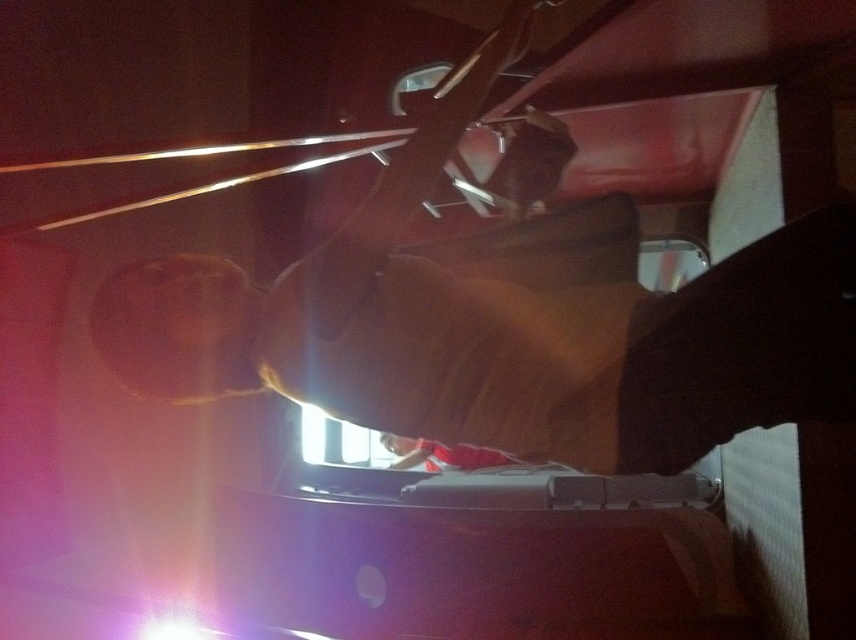
Question: Is brown leather jacket at center smaller than red fabric at center?

Choices:
 (A) yes
 (B) no

Answer: (B)

Question: Does brown leather jacket at center have a lesser width compared to red fabric at center?

Choices:
 (A) yes
 (B) no

Answer: (B)

Question: Can you confirm if brown leather jacket at center is positioned to the left of red fabric at center?

Choices:
 (A) no
 (B) yes

Answer: (A)

Question: Which point appears farthest from the camera in this image?

Choices:
 (A) (441, 464)
 (B) (413, 390)

Answer: (A)

Question: Which of the following is the closest to the observer?

Choices:
 (A) red fabric at center
 (B) brown leather jacket at center

Answer: (B)